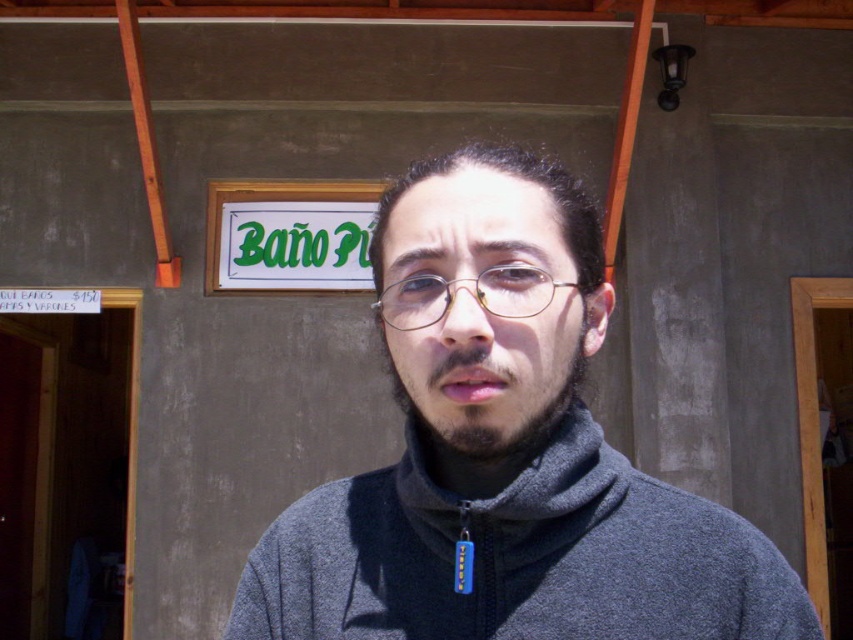
Which of these two, gray fleece jacket at center or gold metallic glasses at center, stands shorter?

Standing shorter between the two is gold metallic glasses at center.

Does gray fleece jacket at center have a larger size compared to gold metallic glasses at center?

Yes, gray fleece jacket at center is bigger than gold metallic glasses at center.

Is point (427, 410) behind point (386, 304)?

No, it is in front of (386, 304).

The height and width of the screenshot is (640, 853). I want to click on gray fleece jacket at center, so click(x=503, y=452).

Where is `gray fleece jacket at center`? The height and width of the screenshot is (640, 853). gray fleece jacket at center is located at coordinates (503, 452).

Does gray fleece jacket at center appear on the right side of dark brown stubble at center?

Yes, gray fleece jacket at center is to the right of dark brown stubble at center.

Which is behind, point (683, 499) or point (544, 380)?

The point (683, 499) is behind.

At what (x,y) coordinates should I click in order to perform the action: click on gray fleece jacket at center. Please return your answer as a coordinate pair (x, y). The image size is (853, 640). Looking at the image, I should click on (503, 452).

Does dark brown stubble at center have a lesser width compared to gold metallic glasses at center?

No.

Who is more distant from viewer, (526, 424) or (427, 324)?

The point (526, 424) is more distant.

I want to click on dark brown stubble at center, so click(x=492, y=371).